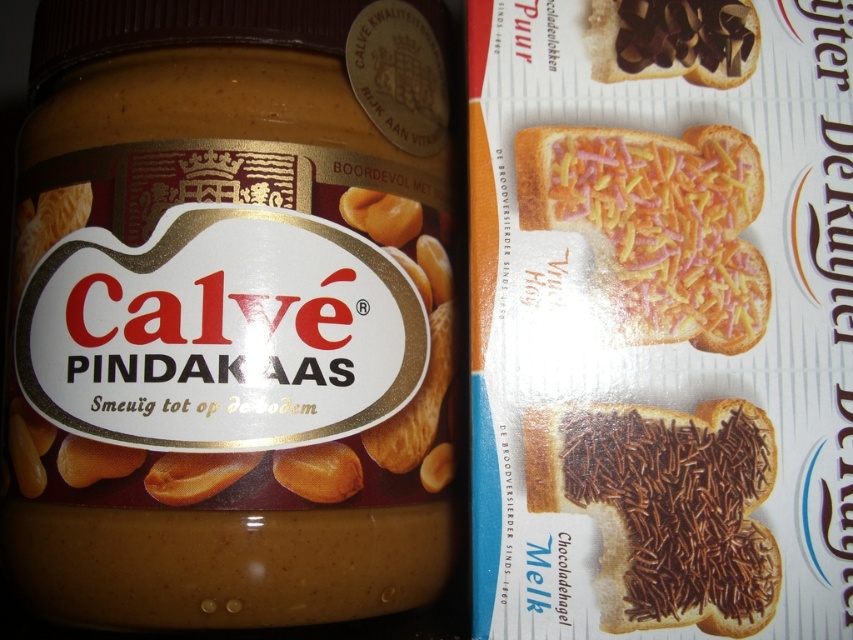
Question: Which point is farther to the camera?

Choices:
 (A) brown crunchy chocolate spread at center
 (B) chocolate spread at upper right
 (C) yellow sprinkled bread at center

Answer: (B)

Question: Among these objects, which one is farthest from the camera?

Choices:
 (A) yellow sprinkled bread at center
 (B) chocolate spread at upper right
 (C) brown crunchy chocolate spread at center

Answer: (B)

Question: Does yellow sprinkled bread at center have a larger size compared to chocolate spread at upper right?

Choices:
 (A) no
 (B) yes

Answer: (B)

Question: Which object is farther from the camera taking this photo?

Choices:
 (A) brown crunchy chocolate spread at center
 (B) yellow sprinkled bread at center

Answer: (B)

Question: Where is brown crunchy chocolate spread at center located in relation to yellow sprinkled bread at center in the image?

Choices:
 (A) below
 (B) above

Answer: (A)

Question: Is brown crunchy chocolate spread at center positioned before yellow sprinkled bread at center?

Choices:
 (A) no
 (B) yes

Answer: (B)